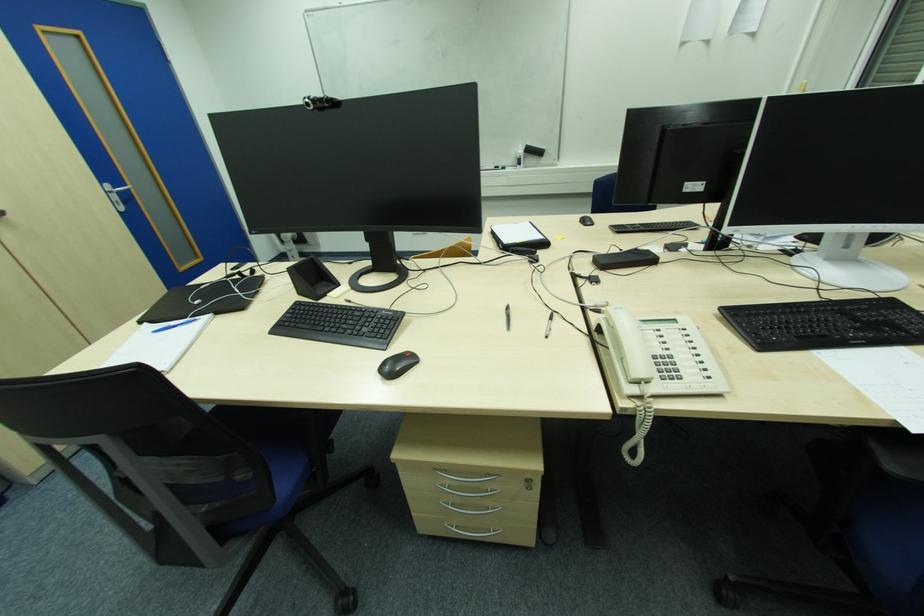
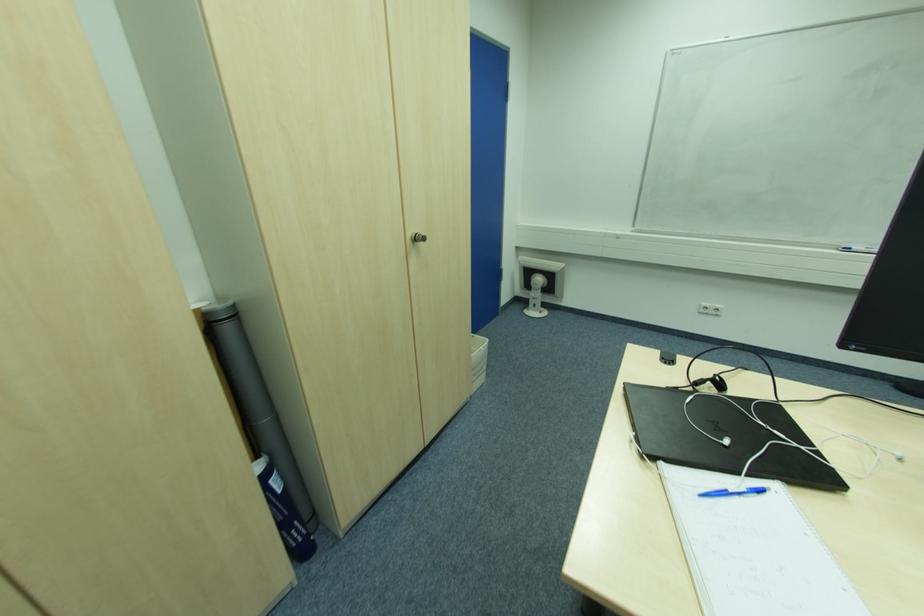
Question: Which direction would the cameraman need to move to produce the second image? Reply with the corresponding letter.

Choices:
 (A) Left
 (B) Right
 (C) Forward
 (D) Backward

Answer: (A)